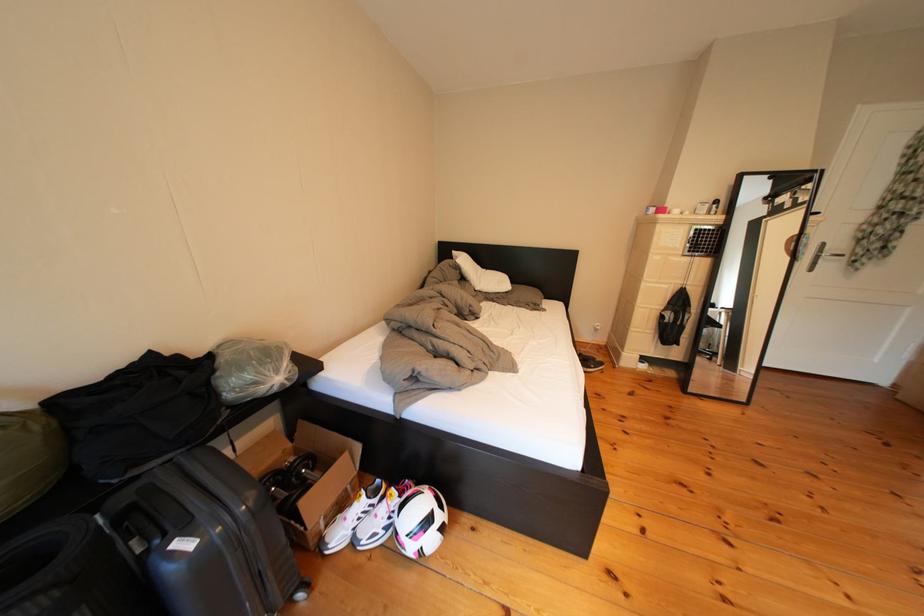
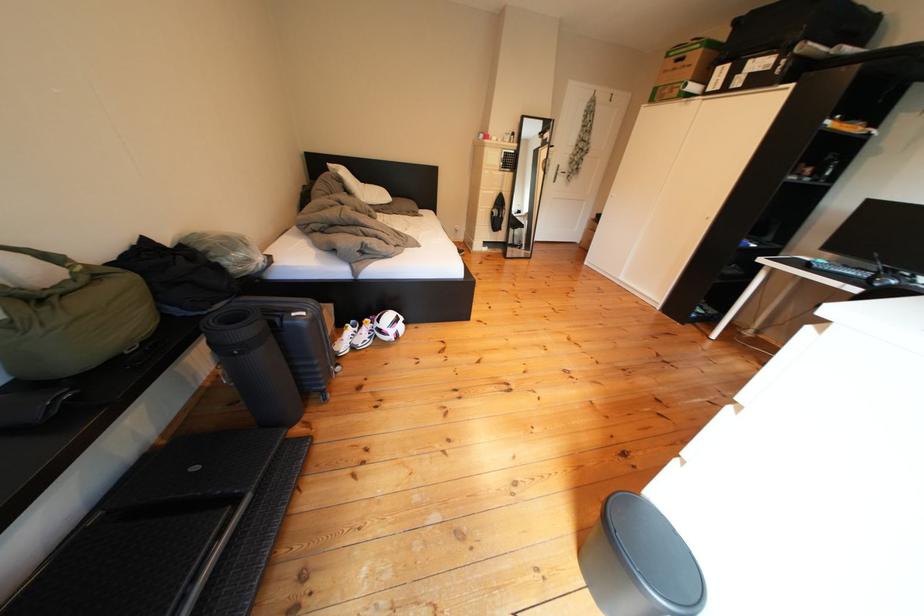
Where in the second image is the point corresponding to pixel 203 551 from the first image?

(317, 318)